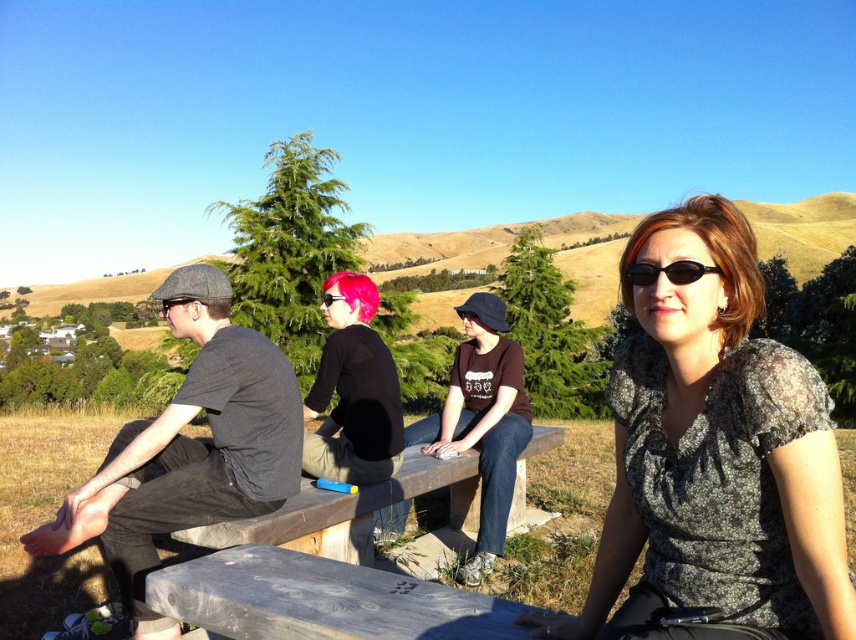
Can you confirm if matte black shirt at center is thinner than pink matte goggles at center?

Indeed, matte black shirt at center has a lesser width compared to pink matte goggles at center.

I want to click on matte black shirt at center, so click(x=354, y=392).

Between point (369, 464) and point (324, 301), which one is positioned behind?

Positioned behind is point (324, 301).

What are the coordinates of `matte black shirt at center` in the screenshot? It's located at (354, 392).

Is matte black shirt at center positioned behind black plastic sunglasses at upper right?

Yes.

Does point (325, 353) come behind point (691, 269)?

Yes, it is.

Locate an element on the screen. Image resolution: width=856 pixels, height=640 pixels. matte black shirt at center is located at coordinates (354, 392).

Who is shorter, dark gray fabric hat at center or pink matte hair at center?

With less height is pink matte hair at center.

Can you confirm if dark gray fabric hat at center is smaller than pink matte hair at center?

No.

This screenshot has height=640, width=856. What do you see at coordinates (482, 420) in the screenshot? I see `dark gray fabric hat at center` at bounding box center [482, 420].

In order to click on dark gray fabric hat at center in this screenshot , I will do `click(482, 420)`.